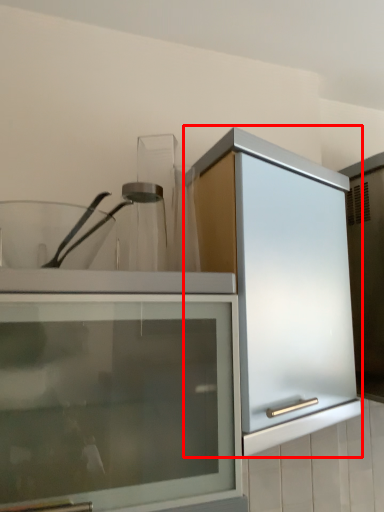
Question: In this image, where is cabinetry (annotated by the red box) located relative to glass jar?

Choices:
 (A) right
 (B) left

Answer: (A)